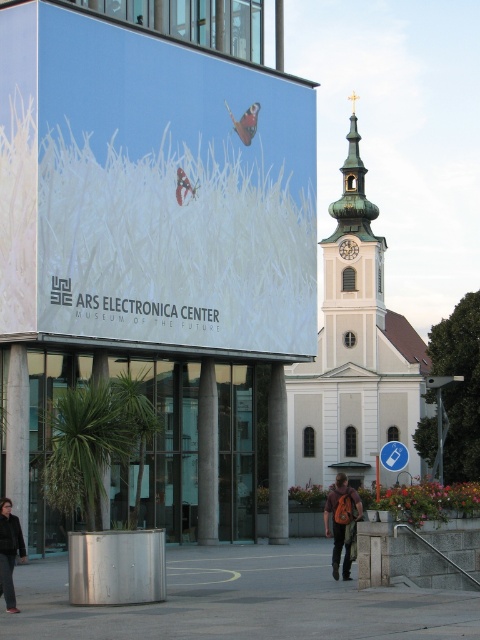
Between point (105, 195) and point (347, 484), which one is positioned behind?

The point (105, 195) is behind.

Is point (95, 72) closer to viewer compared to point (352, 529)?

No.

Measure the distance between point (x=40, y=150) and camera.

They are 54.08 meters apart.

Find the location of a particular element. matte white grass at upper left is located at coordinates (152, 189).

Is point (283, 536) less distant than point (10, 520)?

That is False.

Is white concrete pillar at center above dark gray jacket at lower left?

Yes, white concrete pillar at center is above dark gray jacket at lower left.

Which is in front, point (276, 474) or point (10, 525)?

Positioned in front is point (10, 525).

Find the location of `white concrete pillar at center`. white concrete pillar at center is located at coordinates (277, 456).

Is point (276, 460) positioned in front of point (343, 540)?

No, (276, 460) is further to viewer.

In the scene shown: Who is taller, white concrete pillar at center or orange backpack at center?

With more height is white concrete pillar at center.

Does point (279, 404) lie in front of point (337, 531)?

No, (279, 404) is behind (337, 531).

I want to click on white concrete pillar at center, so click(x=277, y=456).